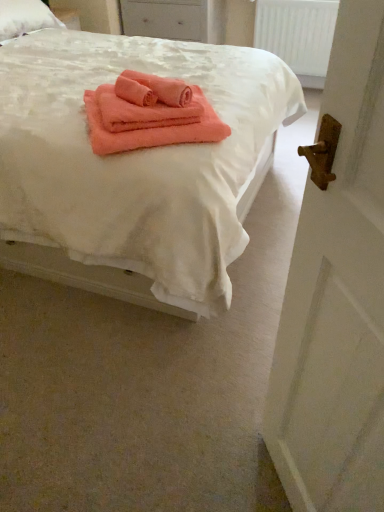
Question: Does white wooden door at right have a lesser height compared to coral soft towel at center?

Choices:
 (A) yes
 (B) no

Answer: (B)

Question: Is white wooden door at right smaller than coral soft towel at center?

Choices:
 (A) yes
 (B) no

Answer: (A)

Question: Does white wooden door at right touch coral soft towel at center?

Choices:
 (A) no
 (B) yes

Answer: (A)

Question: Is white wooden door at right wider than coral soft towel at center?

Choices:
 (A) no
 (B) yes

Answer: (A)

Question: Does white wooden door at right appear on the left side of coral soft towel at center?

Choices:
 (A) yes
 (B) no

Answer: (B)

Question: Can coral soft towel at center be found inside white wooden door at right?

Choices:
 (A) no
 (B) yes

Answer: (A)

Question: Considering the relative positions of coral soft towel at center and white wooden door at right in the image provided, is coral soft towel at center in front of white wooden door at right?

Choices:
 (A) no
 (B) yes

Answer: (A)

Question: From a real-world perspective, does coral soft towel at center sit lower than white wooden door at right?

Choices:
 (A) no
 (B) yes

Answer: (B)

Question: From the image's perspective, is coral soft towel at center located above white wooden door at right?

Choices:
 (A) no
 (B) yes

Answer: (B)

Question: Is coral soft towel at center next to white wooden door at right and touching it?

Choices:
 (A) no
 (B) yes

Answer: (A)

Question: Can you confirm if coral soft towel at center is shorter than white wooden door at right?

Choices:
 (A) no
 (B) yes

Answer: (B)

Question: From the image's perspective, would you say coral soft towel at center is shown under white wooden door at right?

Choices:
 (A) yes
 (B) no

Answer: (B)

Question: Does coral soft towel at center lie behind coral soft towel at center?

Choices:
 (A) no
 (B) yes

Answer: (B)